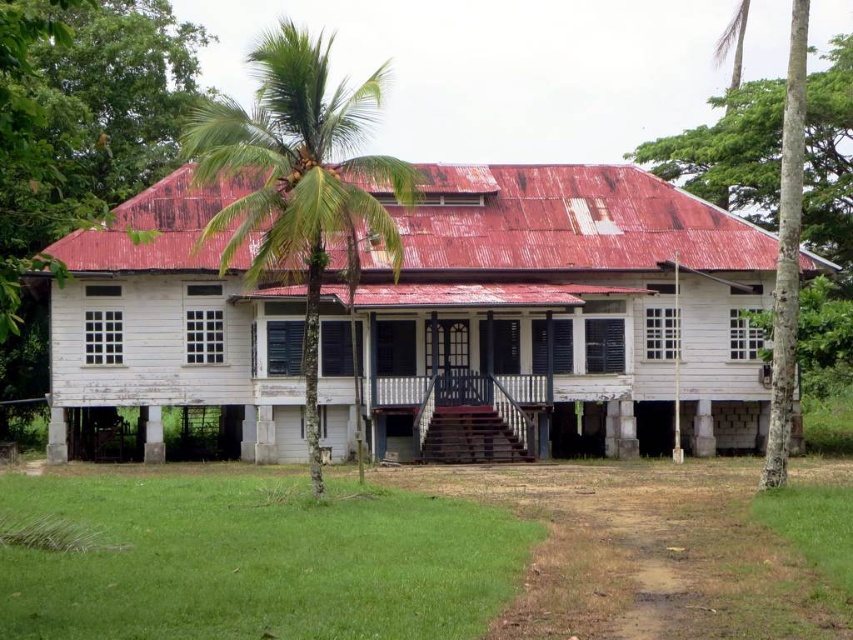
You are an architect designing a new garden layout. You need to decide where to place a new bench that should be wider than the white wooden house at center but narrower than the smooth bark palm tree at right. Is this possible? Please explain using the objects in the scene.

The white wooden house at center is thinner than the smooth bark palm tree at right. Therefore, a bench wider than the white wooden house at center but narrower than the smooth bark palm tree at right can be placed in the garden as there is a size difference between the two objects.

You are standing in front of the two story wooden building. You see a point at coordinates (299, 180). What object is located at that point?

The point at coordinates (299, 180) indicates a green leafy palm tree at center.

You are standing in front of the white wooden house at center and want to walk to the smooth bark palm tree at right. Which direction should you move towards?

The white wooden house at center is positioned on the left side of the smooth bark palm tree at right, so you should move towards the right to reach the smooth bark palm tree at right.